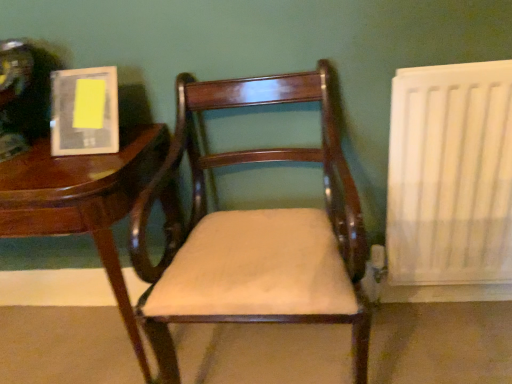
This screenshot has height=384, width=512. Identify the location of vacant point to the right of matte plastic book at upper left. (140, 137).